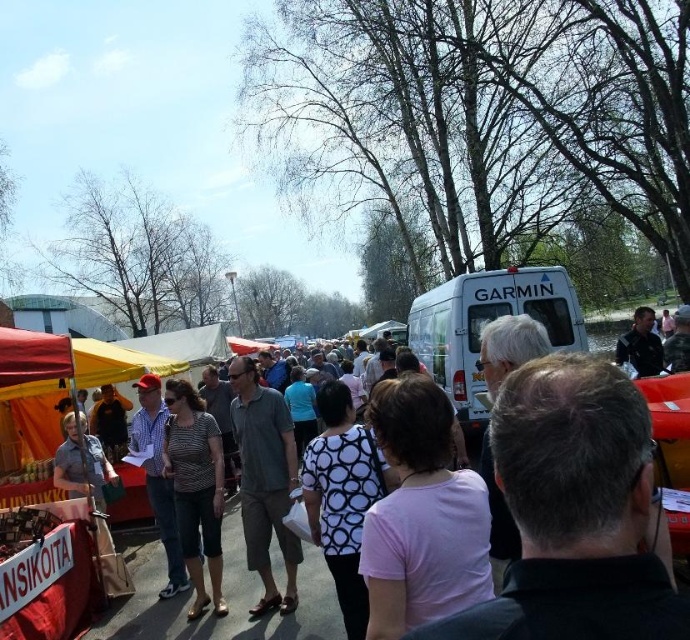
You are standing in the middle of the market and see two points marked in the image. Which point is closer to you, point at (426, 316) or point at (161, 442)?

Point at (426, 316) is closer to you than point at (161, 442) because it is further to the viewer.

You are a photographer trying to capture the entire scene of the market. You notice the white matte van at upper center and the striped fabric shirt at center. Which object should you focus on to ensure both are visible without cropping? Explain your reasoning.

The white matte van at upper center has a smaller size compared to striped fabric shirt at center. To capture both without cropping, focus on the smaller object, the white matte van at upper center, as it requires less space in the frame.

Based on the photo, you are a photographer trying to capture a photo of the striped fabric shirt at center without the white matte van at upper center blocking the view. Based on their heights, is this possible?

The white matte van at upper center is shorter than the striped fabric shirt at center, so the van is shorter than the shirt. Therefore, the van would not block the view of the shirt as the shirt is taller. The photographer can capture the photo without obstruction.